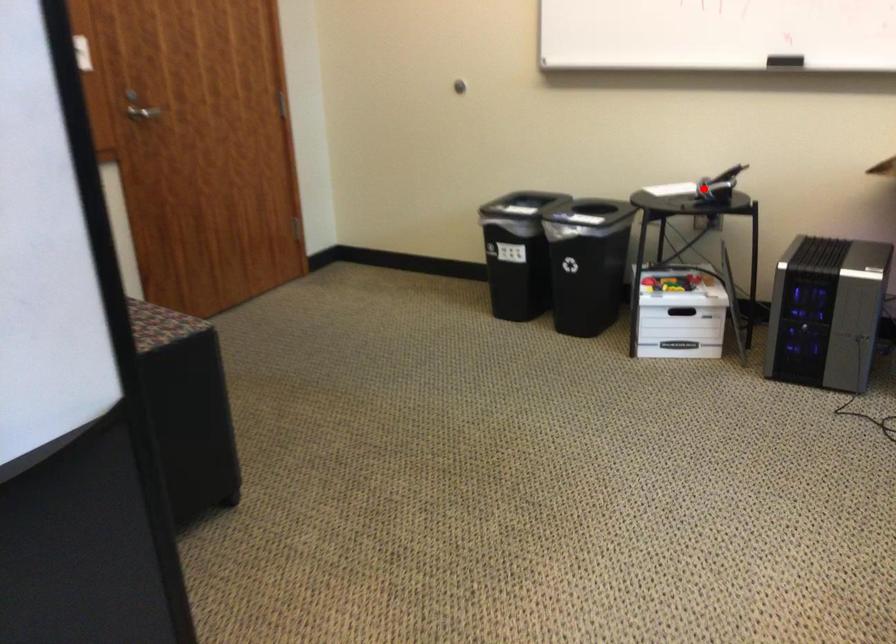
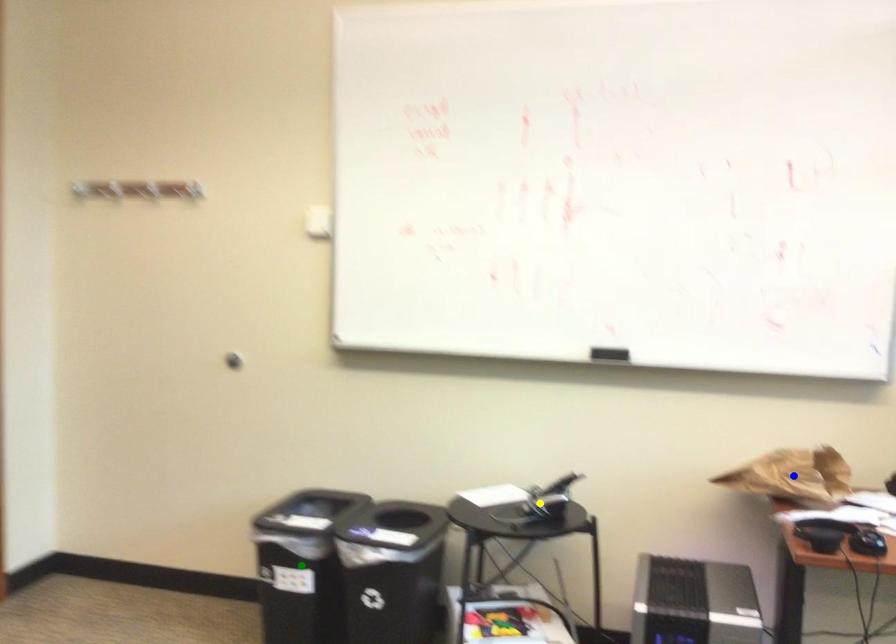
Question: I am providing you with two images of the same scene from different viewpoints. A red point is marked on the first image. You are given multiple points on the second image. In image 2, which mark is for the same physical point as the one in image 1?

Choices:
 (A) blue point
 (B) yellow point
 (C) green point

Answer: (B)